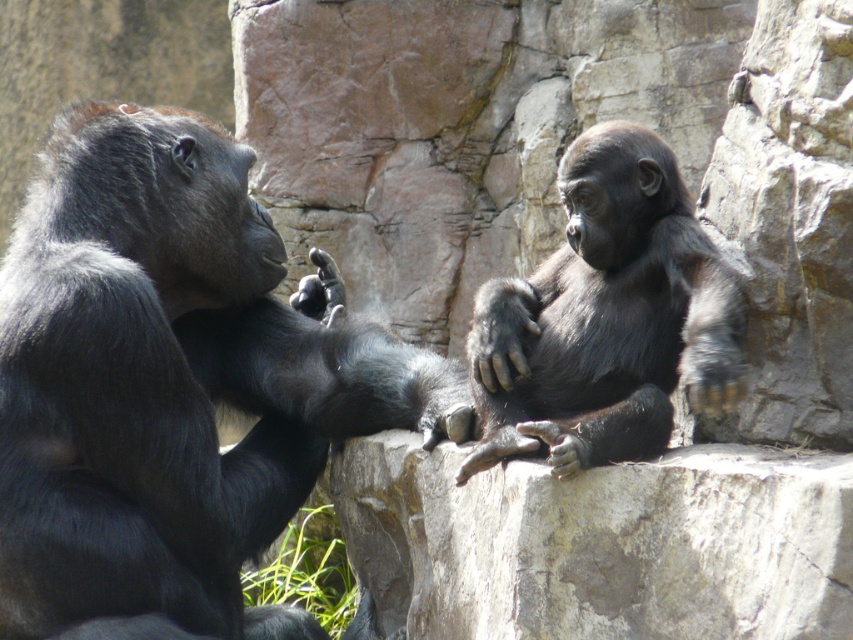
Does shiny black gorilla at left come in front of shiny black gorilla at center?

No, shiny black gorilla at left is behind shiny black gorilla at center.

Who is more forward, (149, 602) or (720, 394)?

Point (720, 394) is more forward.

I want to click on shiny black gorilla at left, so click(171, 385).